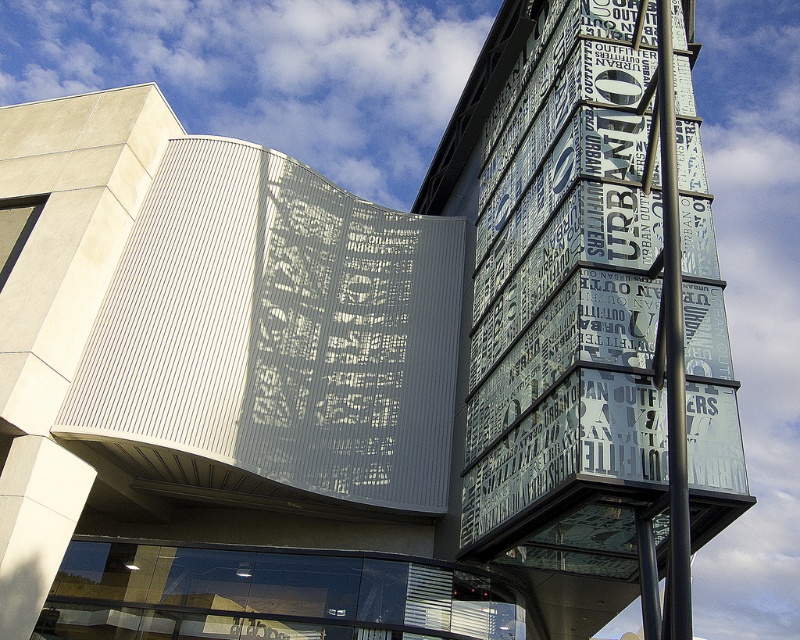
Between transparent glass sign at upper right and metallic pole at center, which one appears on the left side from the viewer's perspective?

Positioned to the left is transparent glass sign at upper right.

The width and height of the screenshot is (800, 640). I want to click on transparent glass sign at upper right, so click(566, 304).

This screenshot has width=800, height=640. Find the location of `transparent glass sign at upper right`. transparent glass sign at upper right is located at coordinates (566, 304).